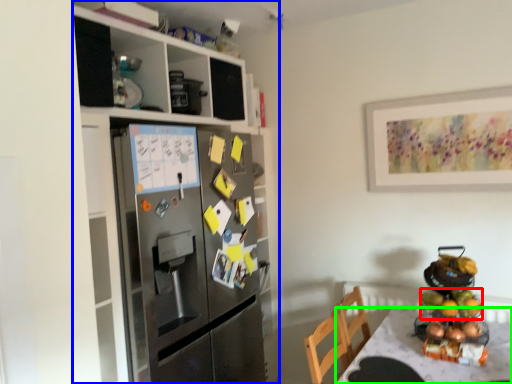
Question: Considering the real-world distances, which object is closest to fruit (highlighted by a red box)? cabinetry (highlighted by a blue box) or desk (highlighted by a green box).

Choices:
 (A) cabinetry
 (B) desk

Answer: (B)